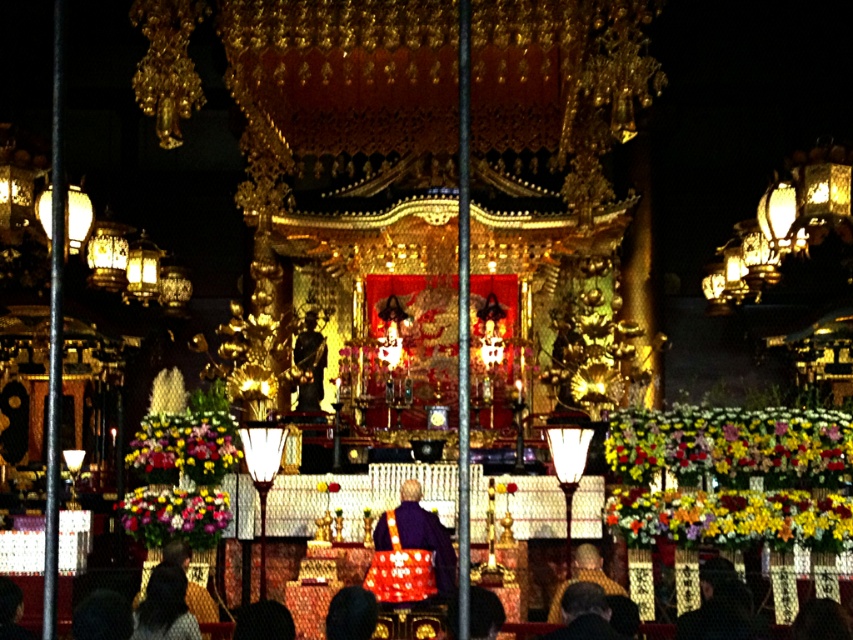
You are standing in front of the mikoshi shrine at the festival. There are two points marked in the scene. The first point is at coordinates point (426, 552) and the second is at point (595, 579). Which of these points is closer to your current position?

Point (426, 552) is closer to the camera than point (595, 579), so the first point is closer to your current position.

You are a photographer positioned in front of the shrine and want to capture both the matte purple kimono at center and the golden robe at center in a single shot. Which garment will appear closer to the camera in the photo?

A: The matte purple kimono at center is further to the viewer than the golden robe at center, so the golden robe at center will appear closer to the camera in the photo.